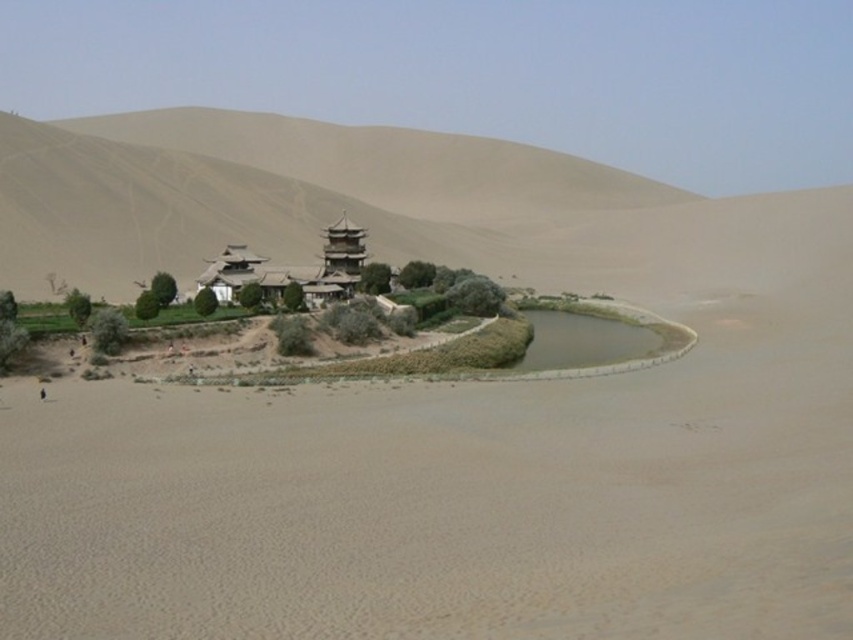
You are an archaeologist examining the desert landscape. You notice the desert sand at center and the sandy beige hill at center. Which of these two has larger grains?

The sandy beige hill at center has larger grains than the desert sand at center, as the desert sand at center has a smaller size compared to the sandy beige hill at center.

You are an explorer in the desert and need to determine the elevation differences between the desert sand at center and the sandy beige hill at center. Which one is lower in height?

The desert sand at center has a lesser height compared to the sandy beige hill at center, so the desert sand at center is lower in height.

You are standing at the coordinates given in the image description. Looking around, you see the desert sand at center. Which direction should you walk to reach the oasis with the green area and traditional buildings?

The oasis with the green area and traditional buildings is located in the midground, which is towards the direction opposite to the desert sand at center. Since the desert sand at center is at point (479, 472), you should walk towards the midground area away from the center coordinates to reach the oasis.